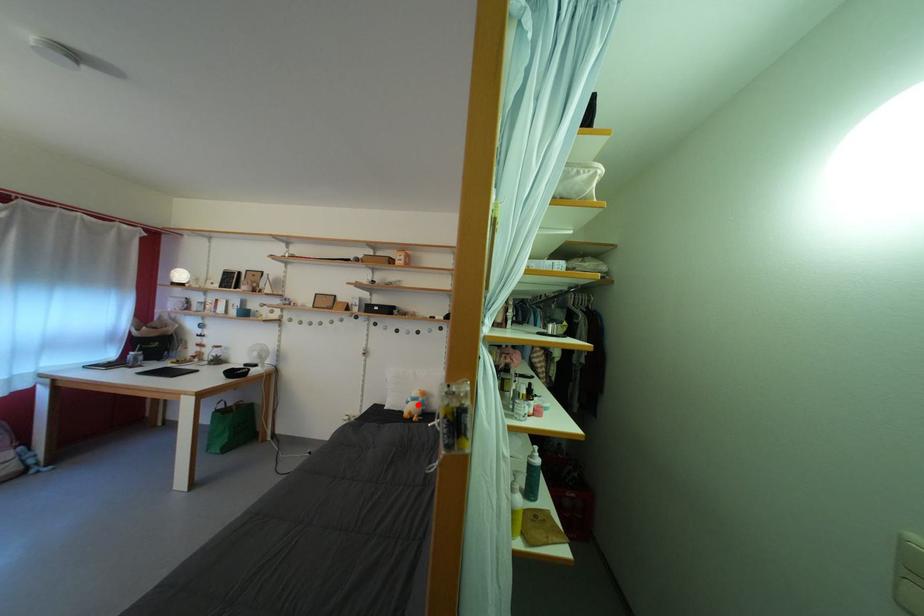
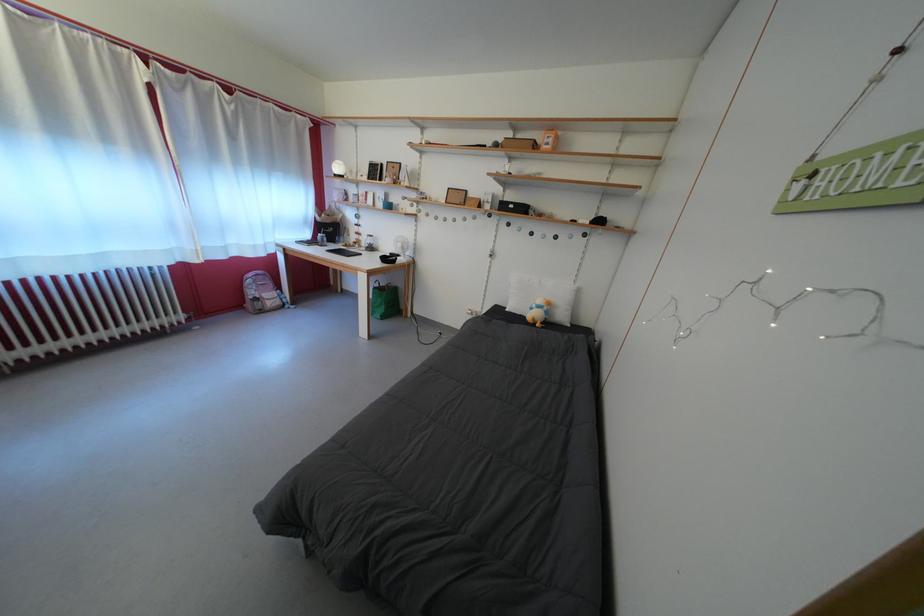
Question: I am providing you with two images of the same scene from different viewpoints. In image1, a red point is highlighted. Considering the same 3D point in image2, which of the following is correct?

Choices:
 (A) It is closer
 (B) It is farther

Answer: (A)